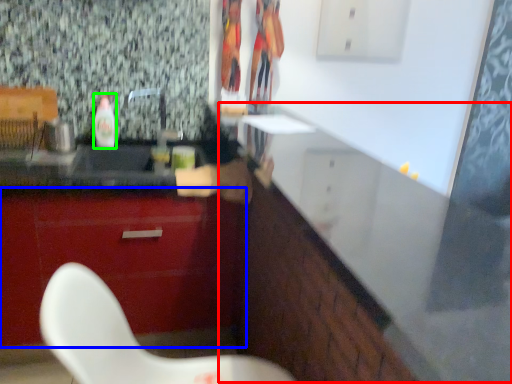
Question: Based on their relative distances, which object is farther from counter (highlighted by a red box)? Choose from cabinetry (highlighted by a blue box) and bottle (highlighted by a green box).

Choices:
 (A) cabinetry
 (B) bottle

Answer: (B)